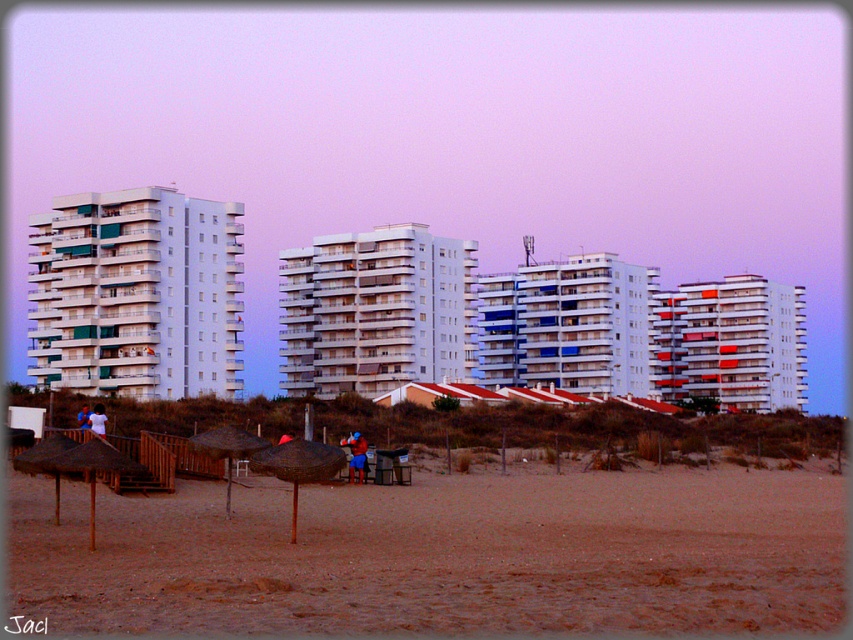
Is point (39, 605) positioned behind point (80, 417)?

No, (39, 605) is in front of (80, 417).

Is brown sandy beach at lower center thinner than blue fabric umbrella at lower left?

Incorrect, brown sandy beach at lower center's width is not less than blue fabric umbrella at lower left's.

Between point (732, 614) and point (83, 403), which one is positioned behind?

Positioned behind is point (83, 403).

The width and height of the screenshot is (853, 640). I want to click on brown sandy beach at lower center, so click(442, 556).

Who is higher up, blue fabric person at center or white fabric shirt at center?

white fabric shirt at center is higher up.

Which is behind, point (355, 435) or point (102, 406)?

Positioned behind is point (102, 406).

This screenshot has height=640, width=853. Describe the element at coordinates (357, 458) in the screenshot. I see `blue fabric person at center` at that location.

The image size is (853, 640). I want to click on blue fabric person at center, so click(x=357, y=458).

Is brown sandy beach at lower center to the right of blue fabric person at center from the viewer's perspective?

Correct, you'll find brown sandy beach at lower center to the right of blue fabric person at center.

The width and height of the screenshot is (853, 640). Identify the location of brown sandy beach at lower center. (442, 556).

At what (x,y) coordinates should I click in order to perform the action: click on brown sandy beach at lower center. Please return your answer as a coordinate pair (x, y). This screenshot has width=853, height=640. Looking at the image, I should click on (442, 556).